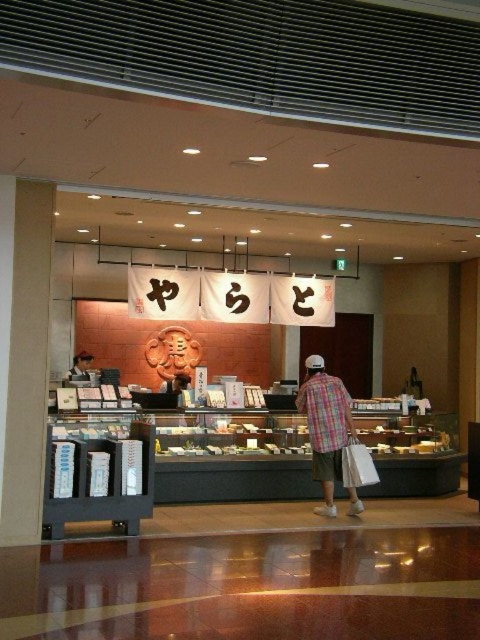
Question: Which point is farther to the camera?

Choices:
 (A) (91, 355)
 (B) (309, 356)

Answer: (A)

Question: Does plaid fabric shirt at center have a lesser width compared to matte black shirt at center?

Choices:
 (A) yes
 (B) no

Answer: (B)

Question: Can you confirm if plaid fabric shirt at center is smaller than matte black shirt at center?

Choices:
 (A) no
 (B) yes

Answer: (A)

Question: Can you confirm if plaid fabric shirt at center is positioned below matte black shirt at center?

Choices:
 (A) yes
 (B) no

Answer: (A)

Question: Which point is closer to the camera?

Choices:
 (A) matte black shirt at center
 (B) plaid fabric shirt at center

Answer: (B)